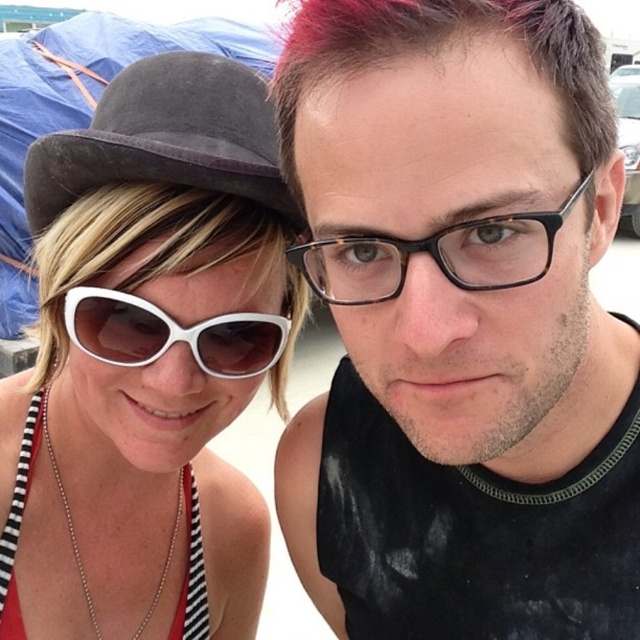
Who is positioned more to the right, white matte hat at upper left or suede fedora at upper left?

suede fedora at upper left

Does white matte hat at upper left appear over suede fedora at upper left?

Incorrect, white matte hat at upper left is not positioned above suede fedora at upper left.

The image size is (640, 640). Find the location of `white matte hat at upper left`. white matte hat at upper left is located at coordinates (147, 362).

Who is positioned more to the right, pink dyed hair at upper center or tortoiseshell frame glasses at center?

pink dyed hair at upper center is more to the right.

Is point (360, 24) behind point (358, 291)?

No, it is in front of (358, 291).

Between point (586, 113) and point (464, 260), which one is positioned behind?

The point (586, 113) is more distant.

Locate an element on the screen. This screenshot has width=640, height=640. pink dyed hair at upper center is located at coordinates (442, 44).

Who is more distant from viewer, (60, 308) or (346, 67)?

Point (60, 308)

Based on the photo, does white matte hat at upper left appear under pink dyed hair at upper center?

Correct, white matte hat at upper left is located below pink dyed hair at upper center.

Is point (189, 161) closer to camera compared to point (506, 20)?

No.

Find the location of a particular element. This screenshot has width=640, height=640. white matte hat at upper left is located at coordinates (147, 362).